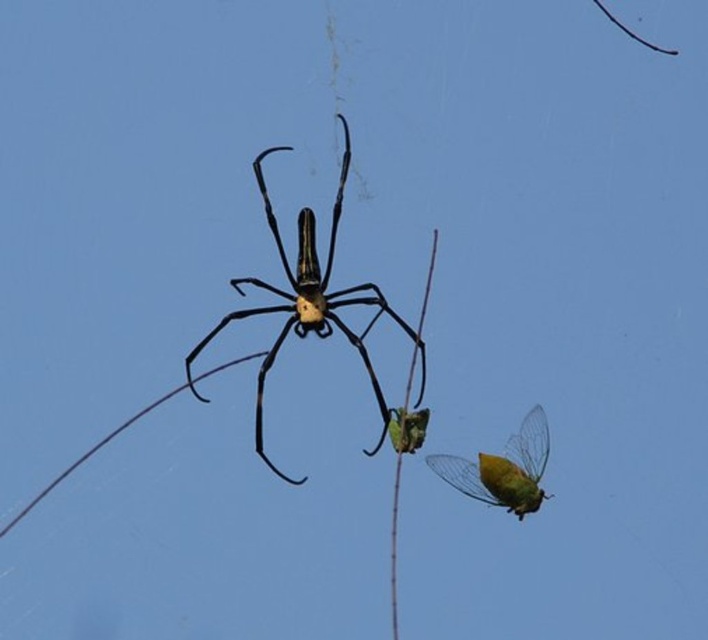
Can you confirm if translucent golden spider at center is positioned to the left of translucent yellow-green wing at lower right?

Correct, you'll find translucent golden spider at center to the left of translucent yellow-green wing at lower right.

Is point (338, 188) farther from camera compared to point (547, 458)?

Yes, it is.

Which is in front, point (371, 385) or point (474, 472)?

Point (474, 472) is more forward.

Find the location of a particular element. This screenshot has height=640, width=708. translucent golden spider at center is located at coordinates (309, 304).